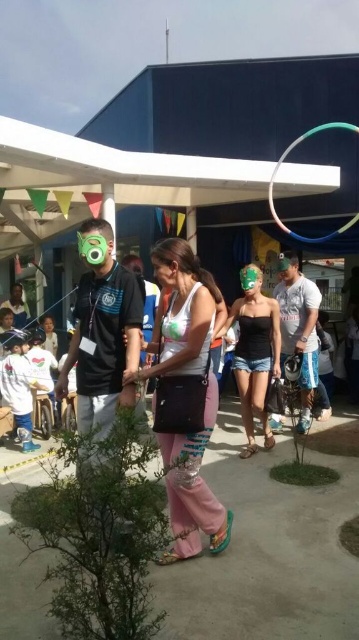
You are a photographer trying to capture a candid shot of the woman in the center. You notice the pink fabric pants at center and the matte green mask at center. Which object should you focus on to ensure it takes up more space in your photo?

The pink fabric pants at center might be wider than matte green mask at center, so focusing on the pink fabric pants at center would likely result in it taking up more space in the photo.

You are a vendor at the event and need to determine which item is more suitable for a child to hold. The matte green mask at center is delicate, and the green rubber hula hoop at upper center is sturdy. Which object is thicker and thus safer for a child to handle?

The green rubber hula hoop at upper center is thicker than the matte green mask at center, making it safer for a child to handle.

You are at a community event and want to place a 10 feet long banner between the green rubber hula hoop at upper center and the green matte goggles at center. Will the banner fit between them?

The distance between the green rubber hula hoop at upper center and the green matte goggles at center is 12.06 feet, so a 10 feet long banner will fit between them since it is shorter than the distance between the two objects.